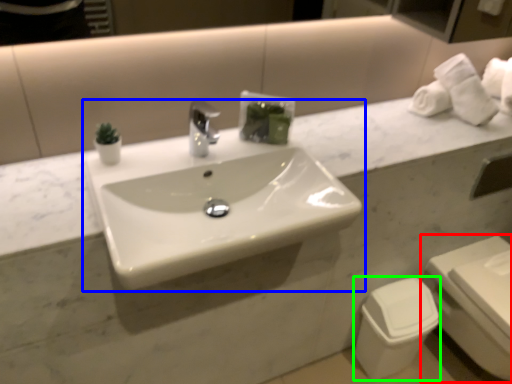
Question: Considering the real-world distances, which object is closest to toilet (highlighted by a red box)? sink (highlighted by a blue box) or toilet bowl (highlighted by a green box).

Choices:
 (A) sink
 (B) toilet bowl

Answer: (B)